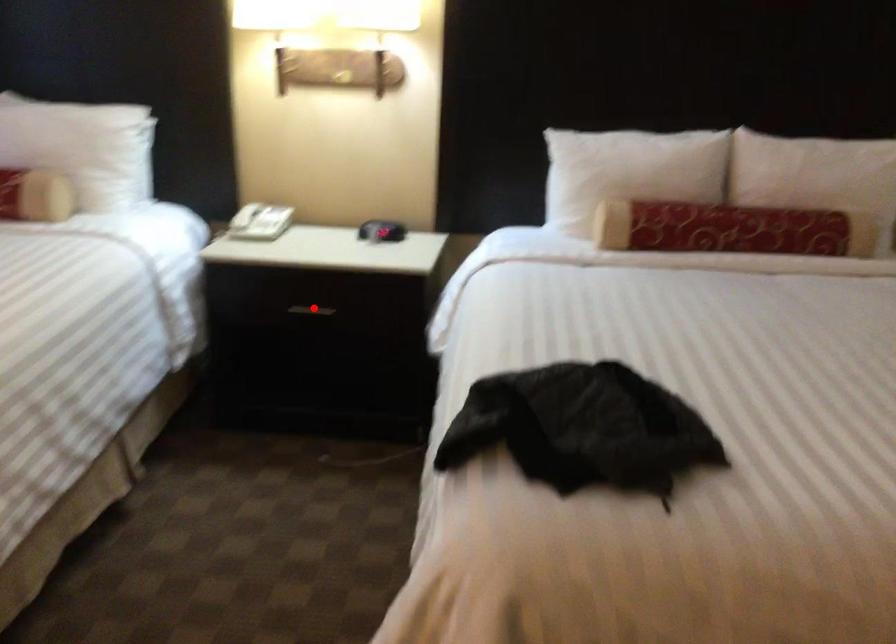
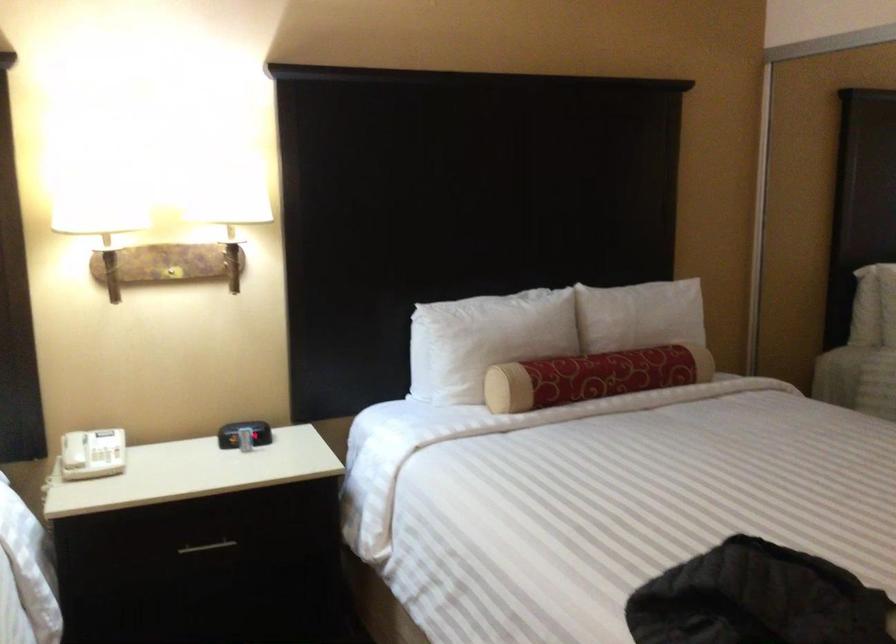
Locate, in the second image, the point that corresponds to the highlighted location in the first image.

(207, 547)